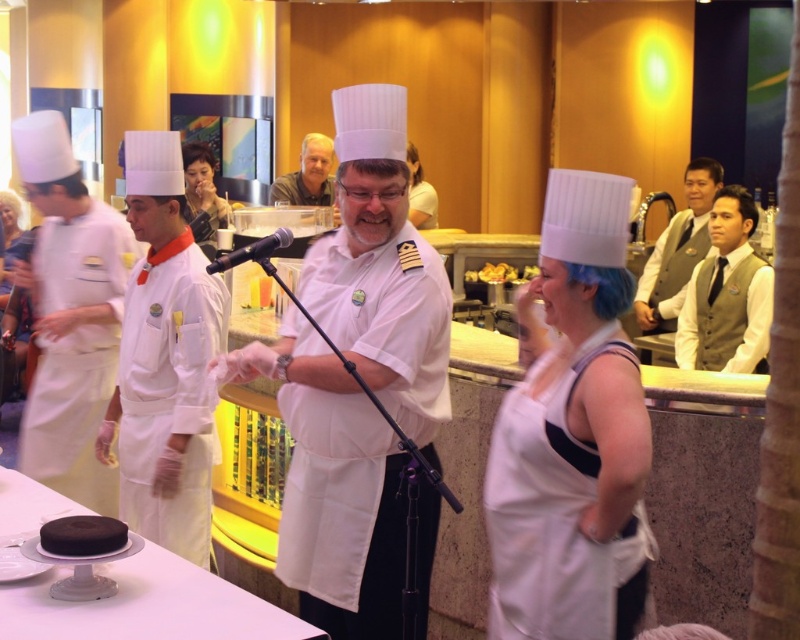
You are a guest at this restaurant and want to find the chef who is speaking to the group. Based on the positions of the white matte uniform at center and the white vest at right, which one is more likely to be the speaker?

The white vest at right is more likely to be the speaker because the white matte uniform at center is positioned below it, indicating the speaker is higher up and addressing the group.

You are a guest at a themed dinner event and are seated 8 feet away from the chocolate matte cake at center. Can you comfortably reach the cake to serve yourself a piece without leaving your seat?

The chocolate matte cake at center is 7.70 feet from viewer. Since you are seated 8 feet away, you are slightly farther than the cake is placed, making it difficult to comfortably reach without moving closer.

You are a guest at this event and want to take a photo of both the chocolate matte cake at center and the black matte microphone at center. Which object should you focus on first to ensure both are in the frame?

You should focus on the chocolate matte cake at center first since it is closer to you than the black matte microphone at center, ensuring both are in the frame by adjusting the camera angle accordingly.